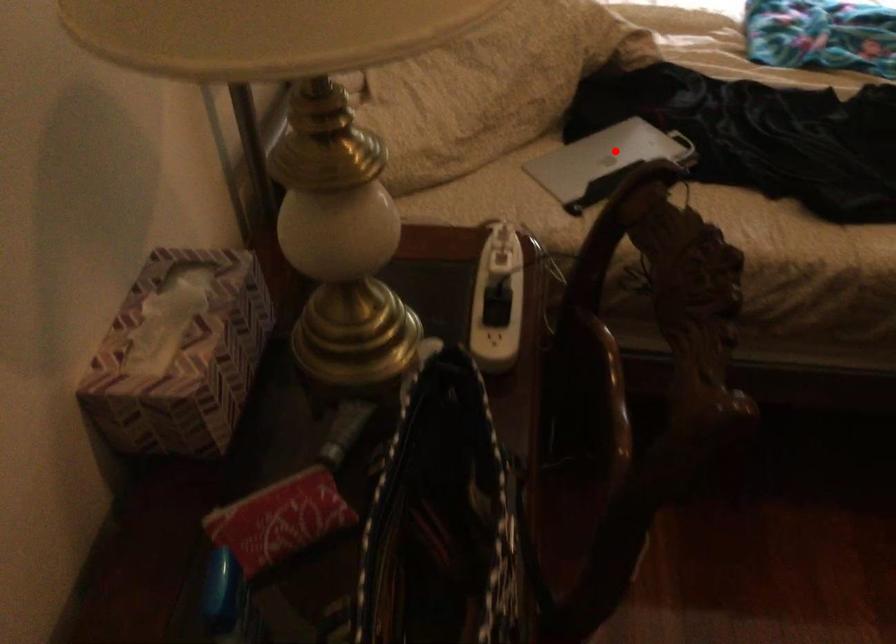
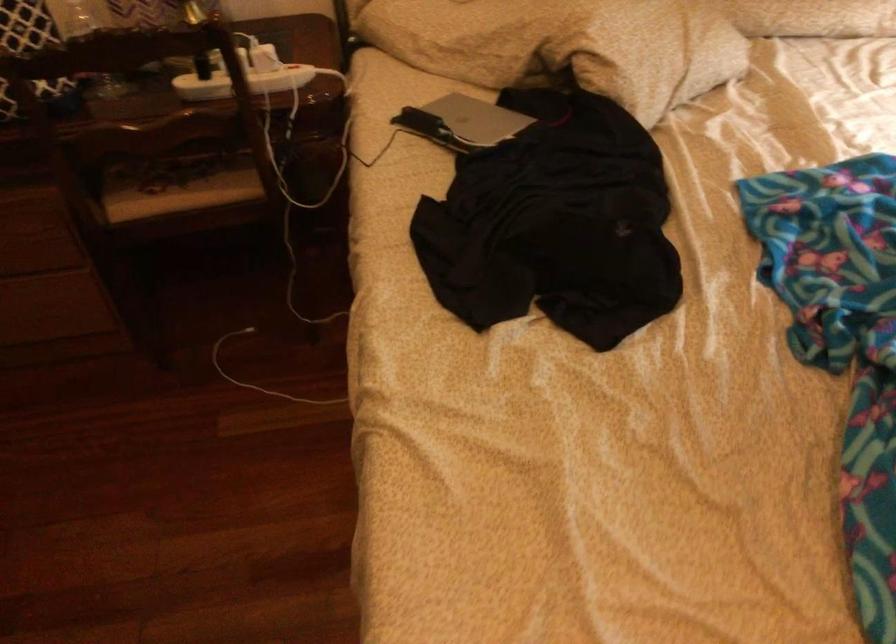
In the second image, find the point that corresponds to the highlighted location in the first image.

(477, 118)